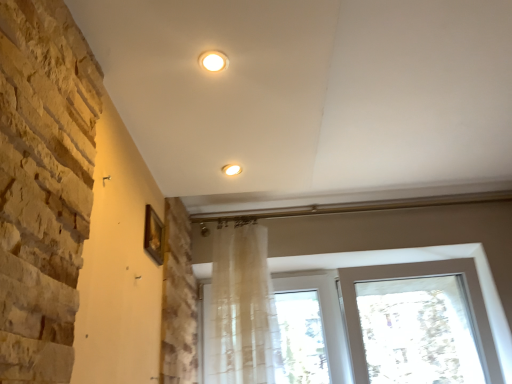
Question: From the image's perspective, is matte white light fixture at center, positioned as the 1th lighting in back-to-front order, located beneath matte white light fixture at upper center, arranged as the second lighting when ordered from the bottom?

Choices:
 (A) no
 (B) yes

Answer: (B)

Question: Is matte white light fixture at center, which is counted as the 1th lighting, starting from the bottom, next to matte white light fixture at upper center, which appears as the first lighting when viewed from the front?

Choices:
 (A) yes
 (B) no

Answer: (B)

Question: Is matte white light fixture at center, which is counted as the 1th lighting, starting from the bottom, facing away from matte white light fixture at upper center, marked as the first lighting in a top-to-bottom arrangement?

Choices:
 (A) yes
 (B) no

Answer: (B)

Question: Does matte white light fixture at center, marked as the 2th lighting in a top-to-bottom arrangement, have a lesser height compared to matte white light fixture at upper center, marked as the first lighting in a top-to-bottom arrangement?

Choices:
 (A) no
 (B) yes

Answer: (A)

Question: Can you confirm if matte white light fixture at center, marked as the 2th lighting in a top-to-bottom arrangement, is bigger than matte white light fixture at upper center, which appears as the first lighting when viewed from the front?

Choices:
 (A) no
 (B) yes

Answer: (A)

Question: Is point (223, 59) closer or farther from the camera than point (89, 188)?

Choices:
 (A) closer
 (B) farther

Answer: (B)

Question: Relative to natural stone wall at left, is matte white light fixture at upper center, the 2th lighting viewed from the back, in front or behind?

Choices:
 (A) front
 (B) behind

Answer: (B)

Question: Is matte white light fixture at upper center, marked as the first lighting in a top-to-bottom arrangement, taller or shorter than natural stone wall at left?

Choices:
 (A) short
 (B) tall

Answer: (A)

Question: Is matte white light fixture at upper center, marked as the first lighting in a top-to-bottom arrangement, to the left or to the right of natural stone wall at left in the image?

Choices:
 (A) right
 (B) left

Answer: (A)

Question: From the image's perspective, is natural stone wall at left located above or below transparent fabric at bottom?

Choices:
 (A) below
 (B) above

Answer: (B)

Question: Looking at the image, does natural stone wall at left seem bigger or smaller compared to transparent fabric at bottom?

Choices:
 (A) big
 (B) small

Answer: (B)

Question: In the image, is natural stone wall at left positioned in front of or behind transparent fabric at bottom?

Choices:
 (A) behind
 (B) front

Answer: (B)

Question: In the image, is natural stone wall at left on the left side or the right side of transparent fabric at bottom?

Choices:
 (A) left
 (B) right

Answer: (A)

Question: Visually, is transparent fabric at bottom positioned to the left or to the right of matte white light fixture at upper center, which appears as the first lighting when viewed from the front?

Choices:
 (A) left
 (B) right

Answer: (B)

Question: Considering their positions, is transparent fabric at bottom located in front of or behind matte white light fixture at upper center, the 2th lighting viewed from the back?

Choices:
 (A) front
 (B) behind

Answer: (B)